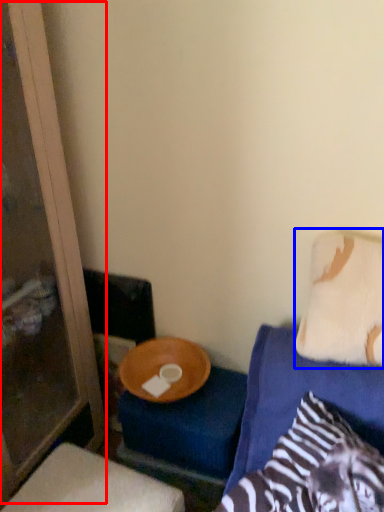
Question: Which point is further to the camera, screen door (highlighted by a red box) or pillow (highlighted by a blue box)?

Choices:
 (A) screen door
 (B) pillow

Answer: (B)